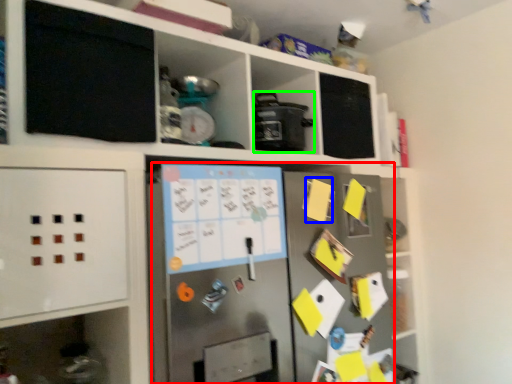
Question: Estimate the real-world distances between objects in this image. Which object is closer to fridge (highlighted by a red box), note (highlighted by a blue box) or appliance (highlighted by a green box)?

Choices:
 (A) note
 (B) appliance

Answer: (A)